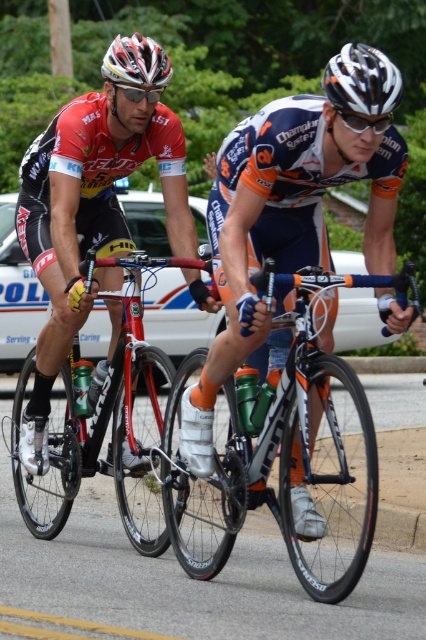
You are a photographer at the cycling event and need to capture a photo that includes both the orange jersey at center and the matte black bicycle at left. Based on their sizes in the image, which object should you focus on first to ensure both are clearly visible in the frame?

The orange jersey at center occupies less space than the matte black bicycle at left, so you should focus on the orange jersey at center first to ensure both are clearly visible in the frame.

You are a photographer positioned at point [293,208]. You want to take a photo of the orange jersey at center. Is there any object blocking your view?

The orange jersey at center is located at point [293,208], so there is no object blocking your view as you are positioned exactly at that point.